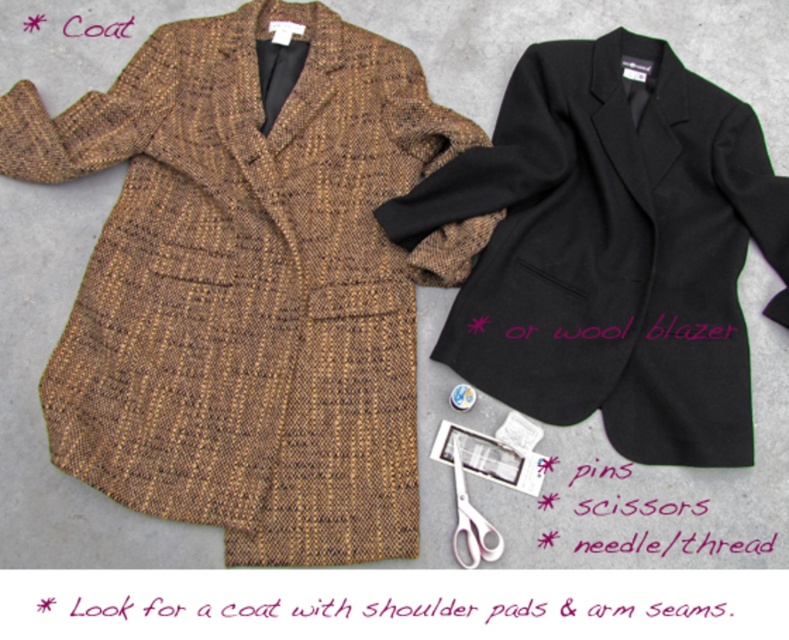
You are a tailor who needs to determine if the brown tweed coat at upper left can be placed on a table that can only accommodate items narrower than the pink plastic scissors at lower center. Can the coat fit on the table?

The brown tweed coat at upper left has a width larger than the pink plastic scissors at lower center, so it cannot fit on the table designed for items narrower than the scissors.

You are a tailor working on two coats laid out on a gray surface. You need to determine which of the two points, point (365, 179) or point (664, 301), is closer to your current position. Which one is closer?

Point (365, 179) is closer to your current position because it is further to the camera than point (664, 301).